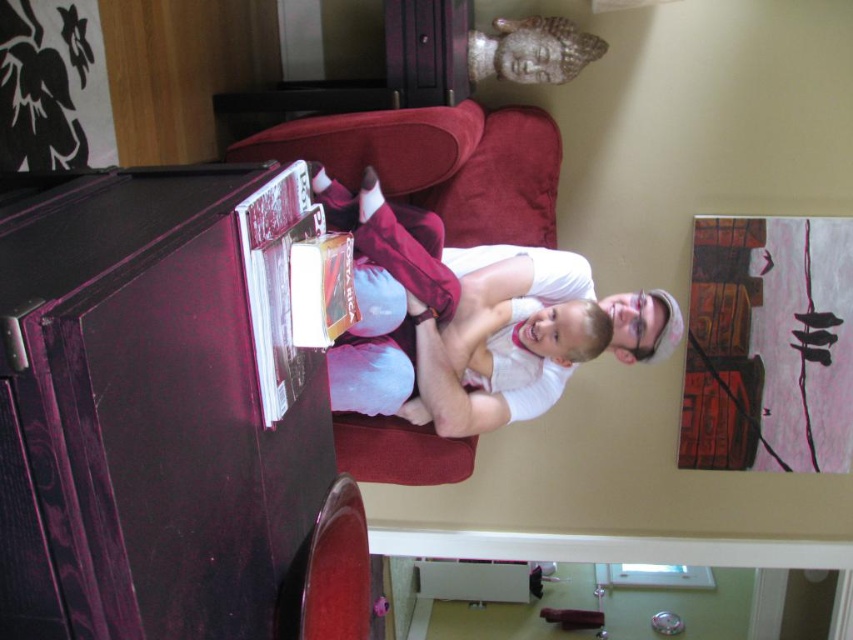
You are trying to decide whether to place a new book on the white cotton shirt at center or the velvet red couch at center. Which object has a wider surface area?

The white cotton shirt at center might be wider than velvet red couch at center, so it could have a wider surface area.